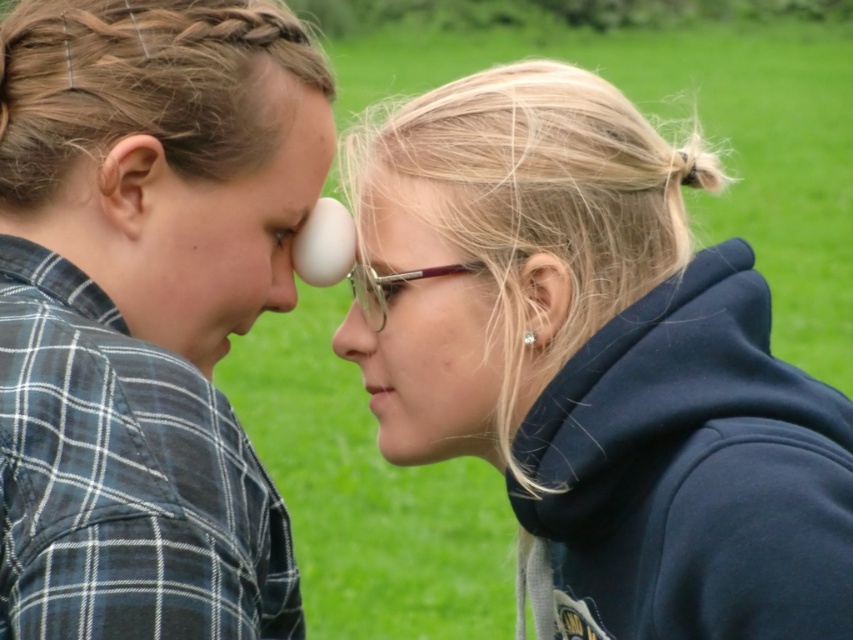
Question: Which point is closer to the camera taking this photo?

Choices:
 (A) (360, 342)
 (B) (270, 268)
 (C) (279, 180)
 (D) (531, 337)

Answer: (C)

Question: Is translucent plastic forehead at center wider than smooth white nose at center?

Choices:
 (A) no
 (B) yes

Answer: (A)

Question: Which point is farther to the camera?

Choices:
 (A) smooth white nose at center
 (B) matte skin ear at upper left
 (C) pearl earring at upper right

Answer: (A)

Question: Considering the real-world distances, which object is closest to the matte black shirt at left?

Choices:
 (A) matte white nose at center
 (B) translucent plastic forehead at center
 (C) pearl earring at upper right

Answer: (A)

Question: Where is satin navy hoodie at right located in relation to matte black shirt at left in the image?

Choices:
 (A) below
 (B) above

Answer: (A)

Question: Can you confirm if satin navy hoodie at right is bigger than matte skin ear at upper left?

Choices:
 (A) yes
 (B) no

Answer: (A)